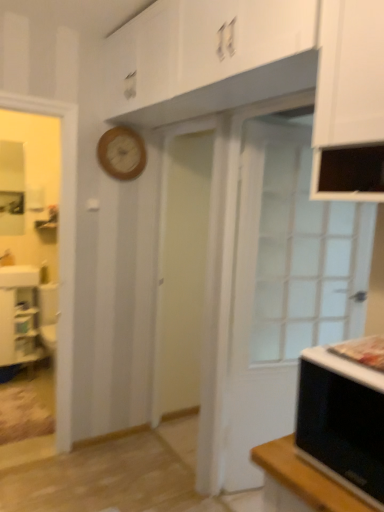
Question: Looking at the image, does wooden clock at upper center seem bigger or smaller compared to white glass door at right?

Choices:
 (A) small
 (B) big

Answer: (A)

Question: In terms of height, does wooden clock at upper center look taller or shorter compared to white glass door at right?

Choices:
 (A) tall
 (B) short

Answer: (B)

Question: Which is farther from the white glass door at right?

Choices:
 (A) black matte microwave oven at lower right
 (B) wooden clock at upper center
 (C) white glossy cabinet at lower left

Answer: (C)

Question: Which of these objects is positioned closest to the wooden clock at upper center?

Choices:
 (A) white glass door at right
 (B) white glossy cabinet at lower left
 (C) black matte microwave oven at lower right

Answer: (A)